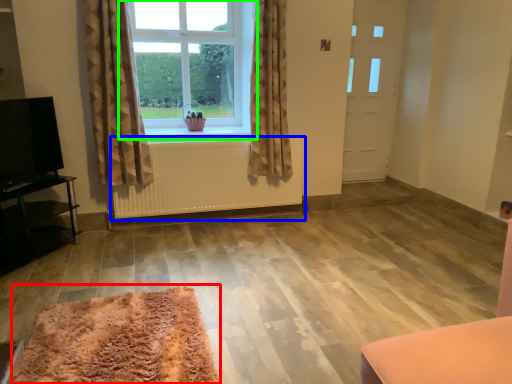
Question: Estimate the real-world distances between objects in this image. Which object is farther from mat (highlighted by a red box), radiator (highlighted by a blue box) or window (highlighted by a green box)?

Choices:
 (A) radiator
 (B) window

Answer: (B)